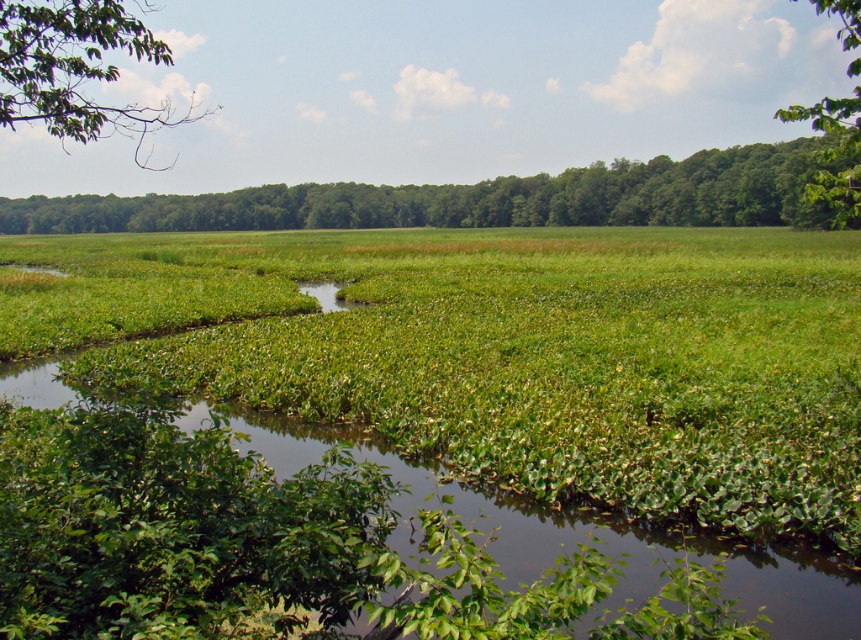
Question: Does green leafy tree at upper center appear under green leafy vegetation at center?

Choices:
 (A) yes
 (B) no

Answer: (B)

Question: In this image, where is green leafy branch at upper left located relative to green leafy tree at upper right?

Choices:
 (A) left
 (B) right

Answer: (A)

Question: Among these objects, which one is nearest to the camera?

Choices:
 (A) green leafy tree at upper right
 (B) green leafy branch at upper left
 (C) green leafy vegetation at center
 (D) green leafy tree at upper center

Answer: (C)

Question: Among these objects, which one is farthest from the camera?

Choices:
 (A) green leafy tree at upper right
 (B) green leafy vegetation at center
 (C) green leafy tree at upper center

Answer: (C)

Question: Where is green leafy tree at upper center located in relation to green leafy tree at upper right in the image?

Choices:
 (A) below
 (B) above

Answer: (A)

Question: Considering the real-world distances, which object is farthest from the green leafy branch at upper left?

Choices:
 (A) green leafy tree at upper center
 (B) green leafy tree at upper right

Answer: (B)